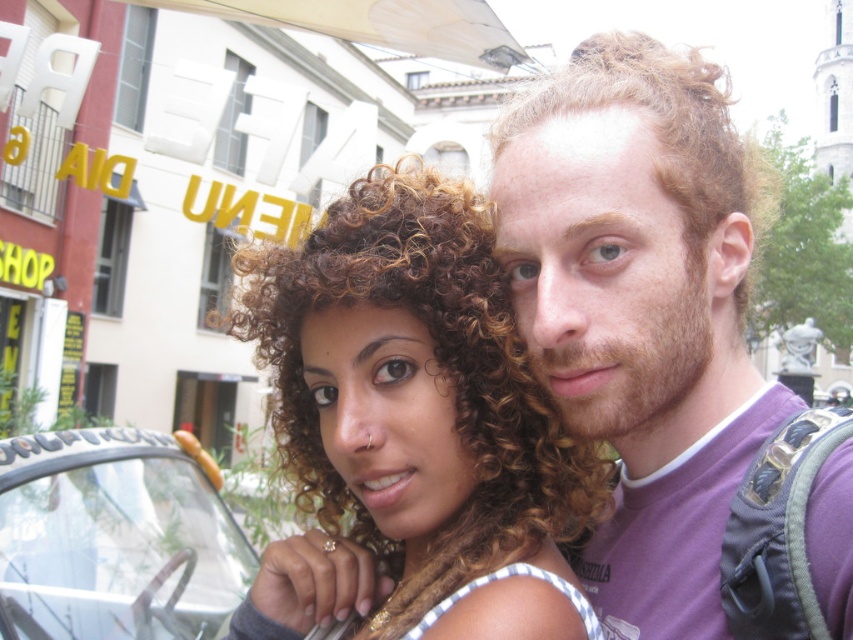
Question: Does purple cotton t-shirt at upper right lie behind transparent plastic car at lower left?

Choices:
 (A) yes
 (B) no

Answer: (B)

Question: Among these points, which one is farthest from the camera?

Choices:
 (A) (76, 612)
 (B) (695, 280)
 (C) (822, 616)
 (D) (421, 344)

Answer: (A)

Question: Does purple cotton t-shirt at upper right appear on the right side of transparent plastic car at lower left?

Choices:
 (A) yes
 (B) no

Answer: (A)

Question: Which of the following is the closest to the observer?

Choices:
 (A) blonde curly hair at upper right
 (B) curly hair at center
 (C) transparent plastic car at lower left

Answer: (B)

Question: Which of the following is the farthest from the observer?

Choices:
 (A) (198, 604)
 (B) (421, 312)
 (C) (659, 45)
 (D) (712, 612)

Answer: (A)

Question: Is transparent plastic car at lower left positioned at the back of blonde curly hair at upper right?

Choices:
 (A) yes
 (B) no

Answer: (B)